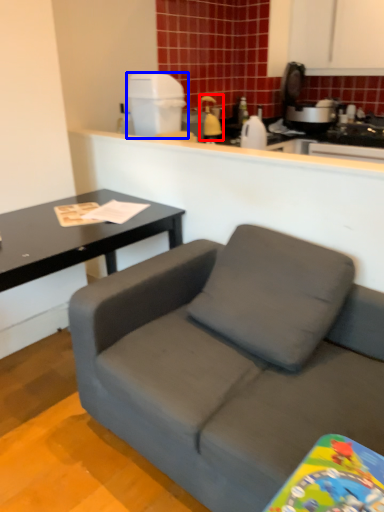
Question: Which object is closer to the camera taking this photo, appliance (highlighted by a red box) or appliance (highlighted by a blue box)?

Choices:
 (A) appliance
 (B) appliance

Answer: (B)